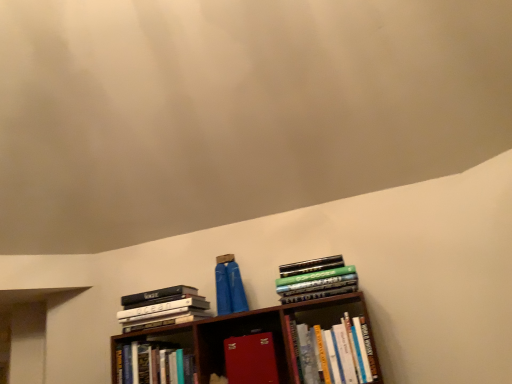
Question: From the image's perspective, is hardcover books at left, placed as the 1th book when sorted from left to right, located above hardcover books at center, the 5th book in the left-to-right sequence?

Choices:
 (A) no
 (B) yes

Answer: (B)

Question: Is hardcover books at left, placed as the 1th book when sorted from left to right, smaller than hardcover books at center, which is the first book in right-to-left order?

Choices:
 (A) no
 (B) yes

Answer: (B)

Question: From a real-world perspective, is hardcover books at left, placed as the 1th book when sorted from left to right, below hardcover books at center, the 5th book in the left-to-right sequence?

Choices:
 (A) no
 (B) yes

Answer: (A)

Question: From the image's perspective, is hardcover books at left, the fifth book when ordered from right to left, under hardcover books at center, the 5th book in the left-to-right sequence?

Choices:
 (A) yes
 (B) no

Answer: (B)

Question: Is the depth of hardcover books at left, placed as the 1th book when sorted from left to right, greater than that of hardcover books at center, the 5th book in the left-to-right sequence?

Choices:
 (A) no
 (B) yes

Answer: (B)

Question: Considering the positions of hardcover books at upper right, acting as the 4th book starting from the left, and hardcover book at lower left, the 2th book in the left-to-right sequence, in the image, is hardcover books at upper right, acting as the 4th book starting from the left, wider or thinner than hardcover book at lower left, the 2th book in the left-to-right sequence,?

Choices:
 (A) thin
 (B) wide

Answer: (B)

Question: In terms of height, does hardcover books at upper right, acting as the 4th book starting from the left, look taller or shorter compared to hardcover book at lower left, positioned as the 4th book in right-to-left order?

Choices:
 (A) tall
 (B) short

Answer: (B)

Question: Does point (338, 291) appear closer or farther from the camera than point (176, 375)?

Choices:
 (A) farther
 (B) closer

Answer: (B)

Question: From the image's perspective, is hardcover books at upper right, the second book when ordered from right to left, located above or below hardcover book at lower left, the 2th book in the left-to-right sequence?

Choices:
 (A) above
 (B) below

Answer: (A)

Question: Considering their positions, is hardcover books at center, the 5th book in the left-to-right sequence, located in front of or behind hardcover book at lower left, the 2th book in the left-to-right sequence?

Choices:
 (A) behind
 (B) front

Answer: (B)

Question: From a real-world perspective, is hardcover books at center, the 5th book in the left-to-right sequence, above or below hardcover book at lower left, the 2th book in the left-to-right sequence?

Choices:
 (A) above
 (B) below

Answer: (B)

Question: Considering the positions of hardcover books at center, the 5th book in the left-to-right sequence, and hardcover book at lower left, positioned as the 4th book in right-to-left order, in the image, is hardcover books at center, the 5th book in the left-to-right sequence, taller or shorter than hardcover book at lower left, positioned as the 4th book in right-to-left order,?

Choices:
 (A) tall
 (B) short

Answer: (A)

Question: From the image's perspective, is hardcover books at center, which is the first book in right-to-left order, above or below hardcover book at lower left, the 2th book in the left-to-right sequence?

Choices:
 (A) below
 (B) above

Answer: (B)

Question: Based on their sizes in the image, would you say matte red suitcase at center, the 3th book positioned from the right, is bigger or smaller than hardcover books at upper right, the second book when ordered from right to left?

Choices:
 (A) small
 (B) big

Answer: (A)

Question: Choose the correct answer: Is matte red suitcase at center, the 3th book positioned from the right, inside hardcover books at upper right, acting as the 4th book starting from the left, or outside it?

Choices:
 (A) inside
 (B) outside

Answer: (B)